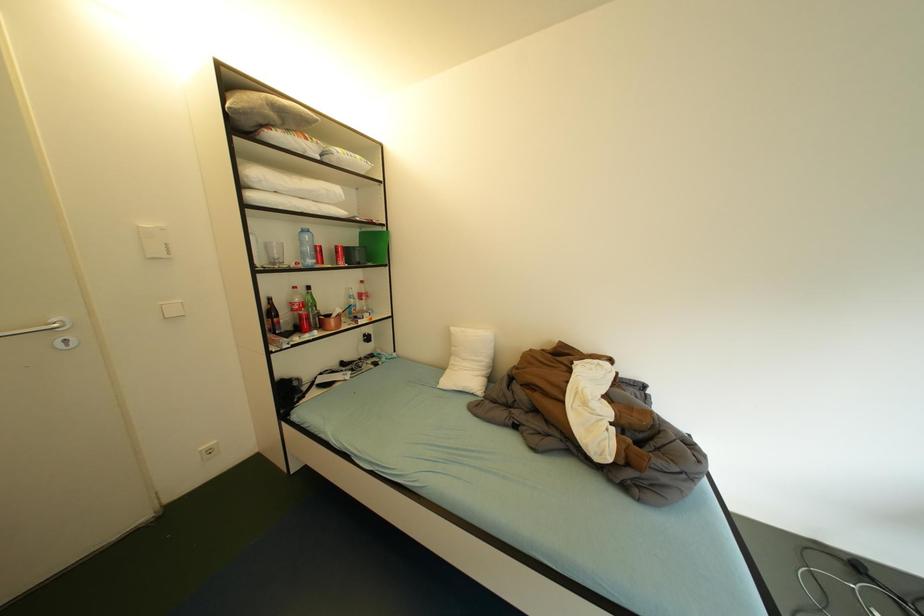
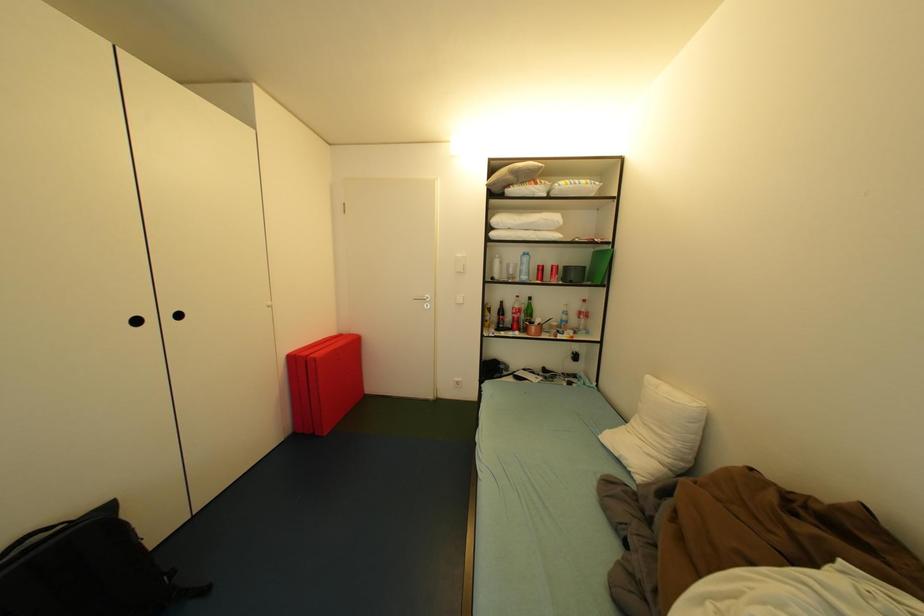
Question: The camera is either moving clockwise (left) or counter-clockwise (right) around the object. The first image is from the beginning of the video and the second image is from the end. Is the camera moving left or right when shooting the video?

Choices:
 (A) Left
 (B) Right

Answer: (B)